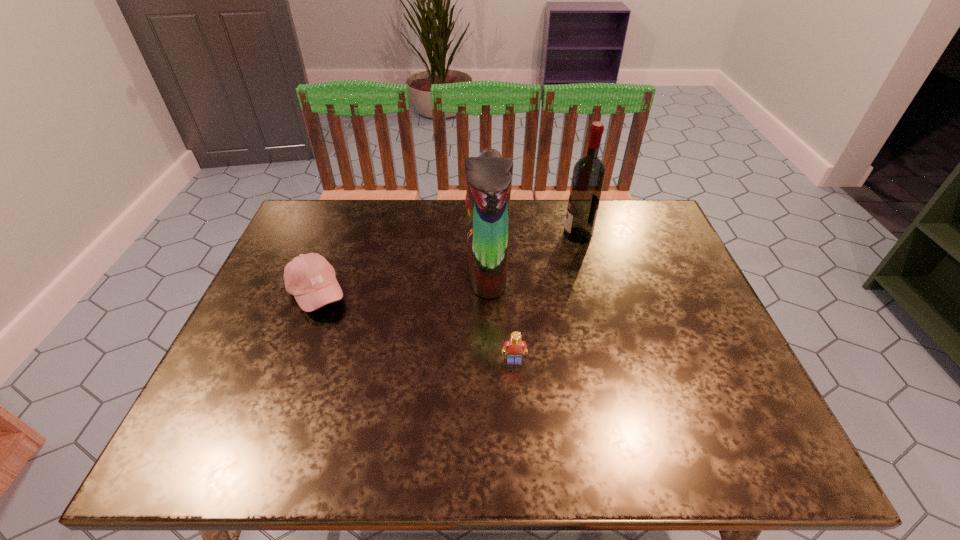
You are a GUI agent. You are given a task and a screenshot of the screen. Output one action in this format:
    pyautogui.click(x=<x>, y=<y>)
    Task: Click on the vacant space that's between the nearest object and the alcohol
    The height and width of the screenshot is (540, 960).
    Given the screenshot: What is the action you would take?
    pyautogui.click(x=546, y=298)

This screenshot has width=960, height=540. What are the coordinates of `free space between the nearest object and the rightmost object` in the screenshot? It's located at (546, 298).

Image resolution: width=960 pixels, height=540 pixels. In order to click on vacant point located between the parrot and the nearest object in this screenshot , I will do `click(500, 315)`.

This screenshot has width=960, height=540. In order to click on blank region between the nearest object and the alcohol in this screenshot , I will do `click(546, 298)`.

Identify the location of empty location between the parrot and the leftmost object. The height and width of the screenshot is (540, 960). (402, 281).

Find the location of `vacant point located between the alcohol and the Lego`. vacant point located between the alcohol and the Lego is located at coordinates (546, 298).

Identify the location of free space between the leftmost object and the nearest object. Image resolution: width=960 pixels, height=540 pixels. (416, 327).

What are the coordinates of `unoccupied area between the rightmost object and the baseball cap` in the screenshot? It's located at (447, 264).

This screenshot has height=540, width=960. In order to click on empty space that is in between the parrot and the nearest object in this screenshot , I will do `click(500, 315)`.

The height and width of the screenshot is (540, 960). Find the location of `vacant area that lies between the parrot and the leftmost object`. vacant area that lies between the parrot and the leftmost object is located at coordinates (402, 281).